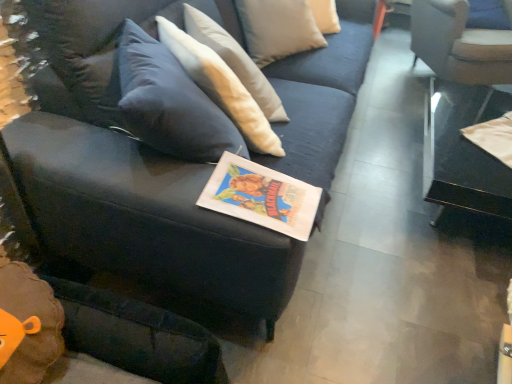
Question: Can you confirm if white fabric chair at upper right is wider than transparent glass table at right?

Choices:
 (A) yes
 (B) no

Answer: (B)

Question: Is white fabric chair at upper right facing away from transparent glass table at right?

Choices:
 (A) yes
 (B) no

Answer: (B)

Question: Is white fabric chair at upper right bigger than transparent glass table at right?

Choices:
 (A) no
 (B) yes

Answer: (A)

Question: Is white fabric chair at upper right taller than transparent glass table at right?

Choices:
 (A) yes
 (B) no

Answer: (A)

Question: Is white fabric chair at upper right positioned beyond the bounds of transparent glass table at right?

Choices:
 (A) yes
 (B) no

Answer: (A)

Question: Does white fabric chair at upper right have a smaller size compared to transparent glass table at right?

Choices:
 (A) yes
 (B) no

Answer: (A)

Question: Is velvet dark blue couch at center looking in the opposite direction of white fabric chair at upper right?

Choices:
 (A) yes
 (B) no

Answer: (B)

Question: From a real-world perspective, is velvet dark blue couch at center located higher than white fabric chair at upper right?

Choices:
 (A) no
 (B) yes

Answer: (B)

Question: From the image's perspective, does velvet dark blue couch at center appear higher than white fabric chair at upper right?

Choices:
 (A) yes
 (B) no

Answer: (B)

Question: Is velvet dark blue couch at center bigger than white fabric chair at upper right?

Choices:
 (A) no
 (B) yes

Answer: (B)

Question: From a real-world perspective, is velvet dark blue couch at center under white fabric chair at upper right?

Choices:
 (A) no
 (B) yes

Answer: (A)

Question: Are velvet dark blue couch at center and white fabric chair at upper right far apart?

Choices:
 (A) no
 (B) yes

Answer: (B)

Question: Is matte paper book at center surrounded by transparent glass table at right?

Choices:
 (A) no
 (B) yes

Answer: (A)